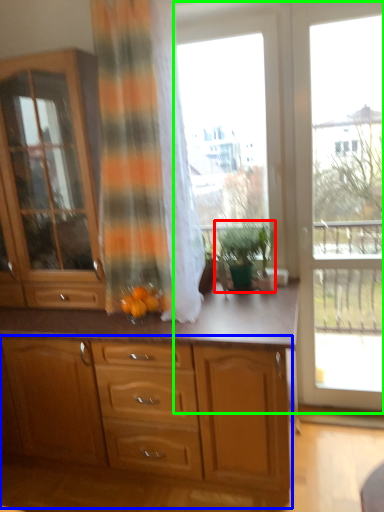
Question: Based on their relative distances, which object is nearer to houseplant (highlighted by a red box)? Choose from cabinetry (highlighted by a blue box) and window frame (highlighted by a green box).

Choices:
 (A) cabinetry
 (B) window frame

Answer: (B)